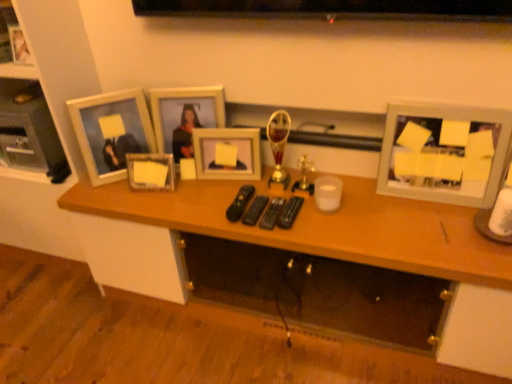
You are a GUI agent. You are given a task and a screenshot of the screen. Output one action in this format:
    pyautogui.click(x=<x>, y=<y>)
    Task: Click on the vacant space situated on the left part of black plastic remote control at center, which appears as the 2th remote control when viewed from the left
    The height and width of the screenshot is (384, 512).
    Given the screenshot: What is the action you would take?
    pyautogui.click(x=204, y=205)